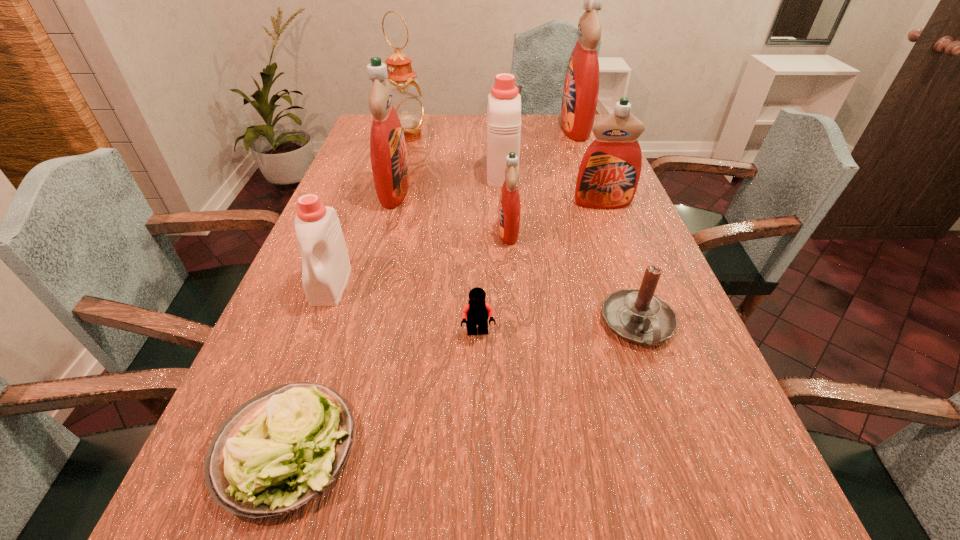
Where is `free space located 0.320m on the front of the oil lamp`? This screenshot has height=540, width=960. free space located 0.320m on the front of the oil lamp is located at coordinates (392, 192).

Find the location of a particular element. The height and width of the screenshot is (540, 960). vacant space located 0.190m on the front surface of the second biggest red detergent is located at coordinates (473, 191).

At what (x,y) coordinates should I click in order to perform the action: click on vacant area situated 0.350m on the handle side of the farther white detergent. Please return your answer as a coordinate pair (x, y). The width and height of the screenshot is (960, 540). Looking at the image, I should click on (497, 116).

This screenshot has width=960, height=540. In order to click on free space located 0.360m on the handle side of the farther white detergent in this screenshot , I will do `click(497, 115)`.

The width and height of the screenshot is (960, 540). What are the coordinates of `vacant space located on the handle side of the farther white detergent` in the screenshot? It's located at (499, 134).

Find the location of a particular element. Image resolution: width=960 pixels, height=540 pixels. vacant space situated on the front surface of the third biggest red detergent is located at coordinates (635, 288).

The image size is (960, 540). Find the location of `free spot located 0.310m on the handle side of the left white detergent`. free spot located 0.310m on the handle side of the left white detergent is located at coordinates (274, 442).

At what (x,y) coordinates should I click in order to perform the action: click on vacant space located 0.050m on the front surface of the nearest red detergent. Please return your answer as a coordinate pair (x, y). This screenshot has width=960, height=540. Looking at the image, I should click on (479, 232).

I want to click on vacant space located 0.070m on the front surface of the nearest red detergent, so click(471, 232).

The image size is (960, 540). In order to click on vacant space situated on the front surface of the nearest red detergent in this screenshot , I will do `click(373, 232)`.